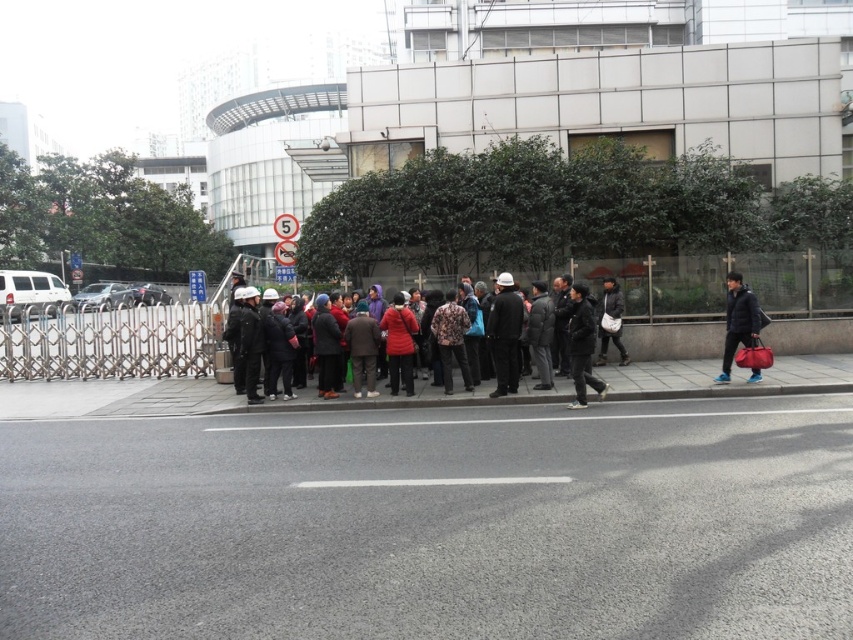
Is gray asphalt road at center shorter than patterned fabric jacket at center?

Indeed, gray asphalt road at center has a lesser height compared to patterned fabric jacket at center.

Is gray asphalt road at center bigger than patterned fabric jacket at center?

No.

Is point (782, 408) more distant than point (450, 337)?

No, (782, 408) is closer to viewer.

The width and height of the screenshot is (853, 640). Identify the location of gray asphalt road at center. (527, 419).

Can you confirm if dark gray fabric jacket at center is taller than patterned fabric jacket at center?

No, dark gray fabric jacket at center is not taller than patterned fabric jacket at center.

Does dark gray fabric jacket at center appear over patterned fabric jacket at center?

No.

Between point (392, 339) and point (466, 312), which one is positioned in front?

Point (392, 339) is in front.

Where is `dark gray fabric jacket at center`? The height and width of the screenshot is (640, 853). dark gray fabric jacket at center is located at coordinates (584, 353).

Between dark gray fabric jacket at center and matte black helmet at center, which one has less height?

Standing shorter between the two is dark gray fabric jacket at center.

Is dark gray fabric jacket at center shorter than matte black helmet at center?

Yes.

Who is more forward, [320,365] or [496,385]?

Positioned in front is point [320,365].

Where is `dark gray fabric jacket at center`? dark gray fabric jacket at center is located at coordinates (584, 353).